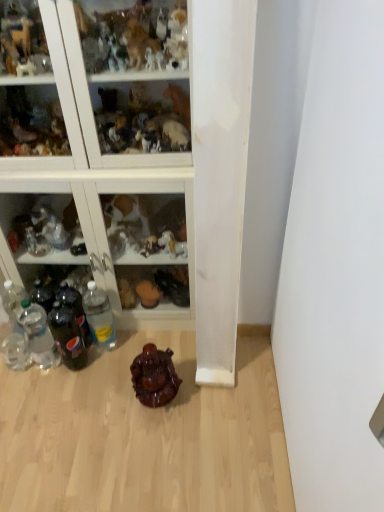
Locate an element on the screen. The height and width of the screenshot is (512, 384). free spot in front of clear plastic bottle at lower left, the fifth bottle viewed from the left is located at coordinates (100, 381).